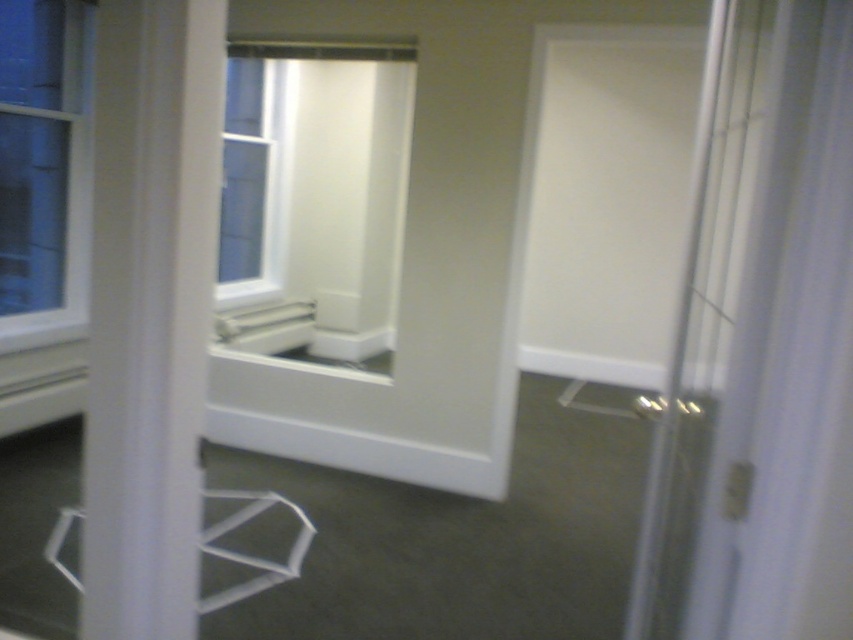
Question: Is the position of clear glass window at left less distant than that of white plastic stool at lower left?

Choices:
 (A) no
 (B) yes

Answer: (A)

Question: Does clear glass window at center come behind white plastic stool at lower left?

Choices:
 (A) yes
 (B) no

Answer: (A)

Question: Which of the following is the closest to the observer?

Choices:
 (A) (86, 108)
 (B) (286, 150)

Answer: (A)

Question: Is white glossy window at center bigger than clear glass window at center?

Choices:
 (A) yes
 (B) no

Answer: (A)

Question: Which of the following is the farthest from the observer?

Choices:
 (A) clear glass window at left
 (B) white glossy window at center
 (C) clear glass window at center
 (D) white plastic stool at lower left

Answer: (C)

Question: Which of the following is the farthest from the observer?

Choices:
 (A) (283, 145)
 (B) (233, 528)
 (C) (51, 156)
 (D) (276, 196)

Answer: (D)